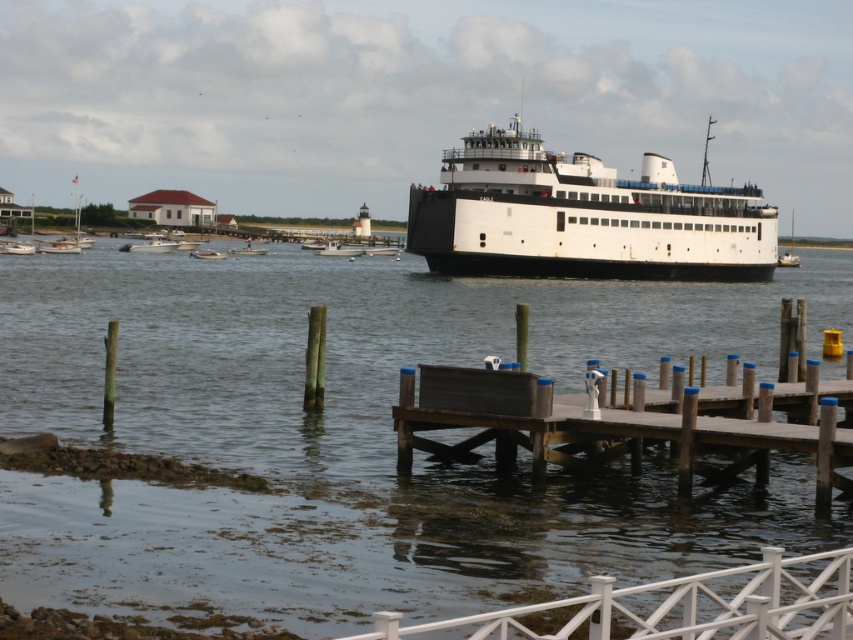
Does white matte ferry boat at upper center appear on the right side of white matte boat at center?

Indeed, white matte ferry boat at upper center is positioned on the right side of white matte boat at center.

Is white matte ferry boat at upper center below white matte boat at center?

Actually, white matte ferry boat at upper center is above white matte boat at center.

Is point (514, 218) more distant than point (346, 250)?

No, it is in front of (346, 250).

Identify the location of white matte ferry boat at upper center. (582, 218).

Does white matte sailboat at left appear on the left side of white plastic boat at center?

Yes, white matte sailboat at left is to the left of white plastic boat at center.

Does white matte sailboat at left appear under white plastic boat at center?

No, white matte sailboat at left is not below white plastic boat at center.

Which is behind, point (56, 243) or point (241, 248)?

Positioned behind is point (241, 248).

Where is `white matte sailboat at left`? white matte sailboat at left is located at coordinates (59, 248).

Which is behind, point (67, 570) or point (582, 269)?

Point (582, 269)

Can you confirm if white matte water at center is smaller than white matte ferry boat at upper center?

Incorrect, white matte water at center is not smaller in size than white matte ferry boat at upper center.

Which is behind, point (401, 532) or point (619, 256)?

Point (619, 256)

The width and height of the screenshot is (853, 640). Find the location of `white matte water at center`. white matte water at center is located at coordinates (361, 436).